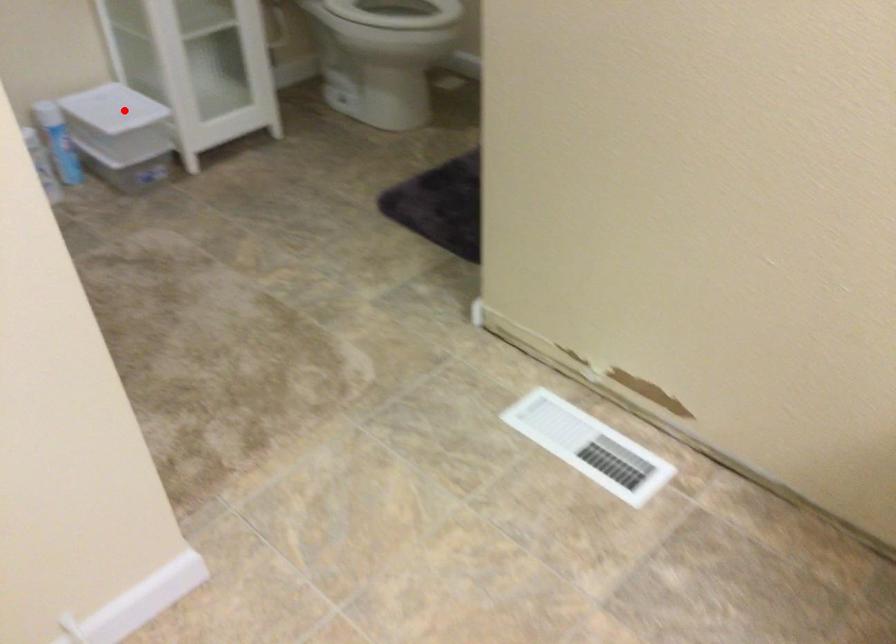
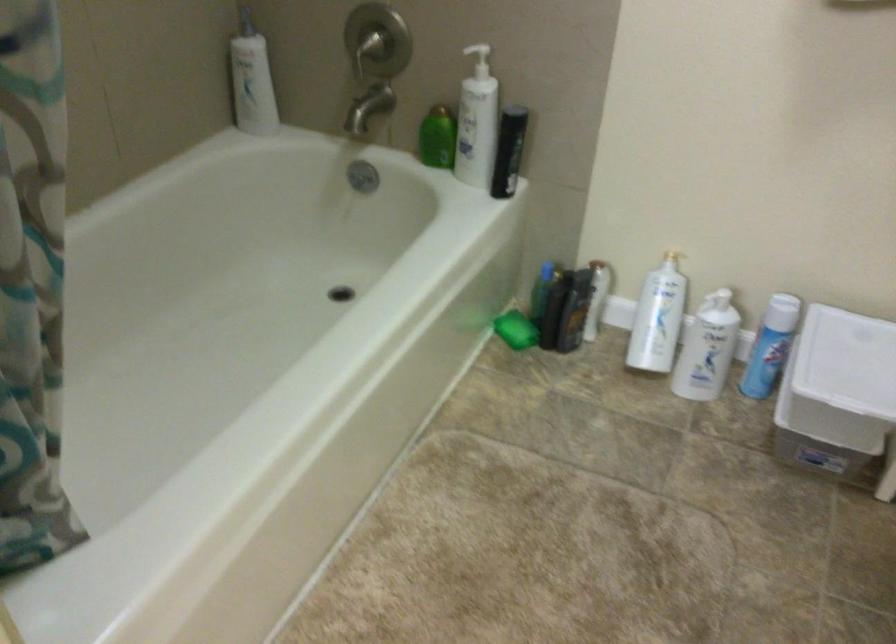
Question: I am providing you with two images of the same scene from different viewpoints. Given a red point in image1, look at the same physical point in image2. Is it:

Choices:
 (A) Closer to the viewpoint
 (B) Farther from the viewpoint

Answer: (A)